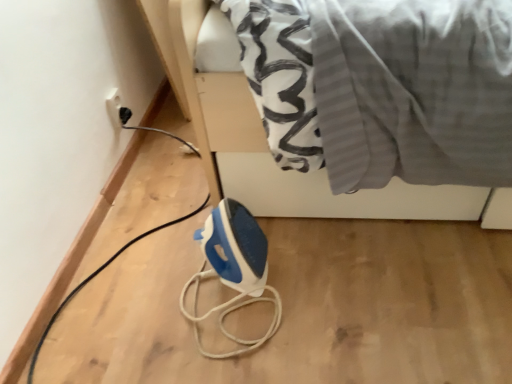
Question: Can you confirm if white plastic socket at upper left is wider than white glossy bed at upper center?

Choices:
 (A) yes
 (B) no

Answer: (B)

Question: Is white plastic socket at upper left beside white glossy bed at upper center?

Choices:
 (A) no
 (B) yes

Answer: (A)

Question: Considering the relative positions of white plastic socket at upper left and white glossy bed at upper center in the image provided, is white plastic socket at upper left in front of white glossy bed at upper center?

Choices:
 (A) yes
 (B) no

Answer: (B)

Question: Does white plastic socket at upper left have a smaller size compared to white glossy bed at upper center?

Choices:
 (A) no
 (B) yes

Answer: (B)

Question: From a real-world perspective, is white plastic socket at upper left on white glossy bed at upper center?

Choices:
 (A) yes
 (B) no

Answer: (B)

Question: Is blue plastic iron at lower center to the left or to the right of white glossy bed at upper center in the image?

Choices:
 (A) right
 (B) left

Answer: (B)

Question: Considering the positions of blue plastic iron at lower center and white glossy bed at upper center in the image, is blue plastic iron at lower center wider or thinner than white glossy bed at upper center?

Choices:
 (A) thin
 (B) wide

Answer: (A)

Question: Do you think blue plastic iron at lower center is within white glossy bed at upper center, or outside of it?

Choices:
 (A) inside
 (B) outside

Answer: (B)

Question: From a real-world perspective, is blue plastic iron at lower center physically located above or below white glossy bed at upper center?

Choices:
 (A) below
 (B) above

Answer: (A)

Question: Based on their sizes in the image, would you say white glossy bed at upper center is bigger or smaller than white plastic socket at upper left?

Choices:
 (A) big
 (B) small

Answer: (A)

Question: Relative to white plastic socket at upper left, is white glossy bed at upper center in front or behind?

Choices:
 (A) behind
 (B) front

Answer: (B)

Question: In terms of height, does white glossy bed at upper center look taller or shorter compared to white plastic socket at upper left?

Choices:
 (A) short
 (B) tall

Answer: (B)

Question: In the image, is white glossy bed at upper center on the left side or the right side of white plastic socket at upper left?

Choices:
 (A) right
 (B) left

Answer: (A)

Question: Is white glossy bed at upper center to the left or to the right of blue plastic iron at lower center in the image?

Choices:
 (A) left
 (B) right

Answer: (B)

Question: Is white glossy bed at upper center in front of or behind blue plastic iron at lower center in the image?

Choices:
 (A) behind
 (B) front

Answer: (B)